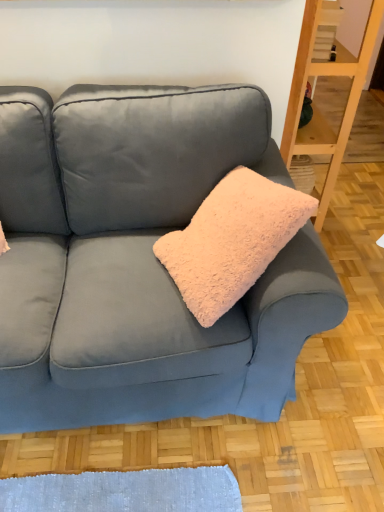
Question: From a real-world perspective, relative to wooden shelf at right, is velvet blue couch at center vertically above or below?

Choices:
 (A) above
 (B) below

Answer: (B)

Question: Is velvet blue couch at center inside or outside of wooden shelf at right?

Choices:
 (A) outside
 (B) inside

Answer: (A)

Question: Which object is the closest to the wooden shelf at right?

Choices:
 (A) velvet blue couch at center
 (B) fuzzy pink pillow at center

Answer: (B)

Question: Which object is positioned closest to the fuzzy pink pillow at center?

Choices:
 (A) velvet blue couch at center
 (B) wooden shelf at right

Answer: (A)